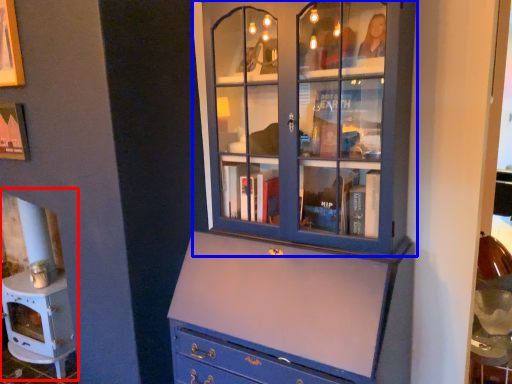
Question: Among these objects, which one is nearest to the camera, fireplace (highlighted by a red box) or cupboard (highlighted by a blue box)?

Choices:
 (A) fireplace
 (B) cupboard

Answer: (B)